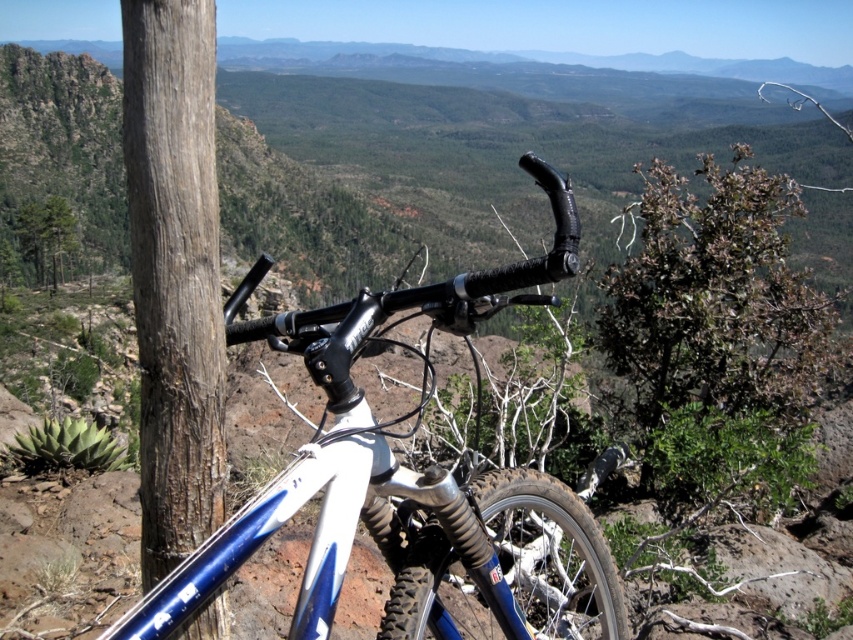
Who is positioned more to the left, blue matte bicycle handlebars at center or smooth brown wood at left?

smooth brown wood at left

Is blue matte bicycle handlebars at center wider than smooth brown wood at left?

Yes.

Between point (496, 612) and point (160, 8), which one is positioned behind?

Positioned behind is point (160, 8).

Where is `blue matte bicycle handlebars at center`? The image size is (853, 640). blue matte bicycle handlebars at center is located at coordinates (x=415, y=490).